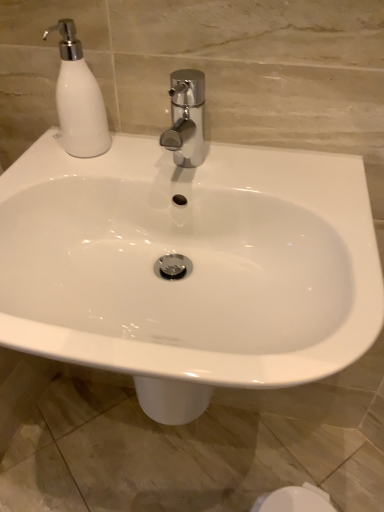
Question: From the image's perspective, is white glossy sink at center positioned above or below white glossy soap dispenser at upper left?

Choices:
 (A) below
 (B) above

Answer: (A)

Question: From a real-world perspective, is white glossy sink at center positioned above or below white glossy soap dispenser at upper left?

Choices:
 (A) below
 (B) above

Answer: (A)

Question: Looking at their shapes, would you say white glossy sink at center is wider or thinner than white glossy soap dispenser at upper left?

Choices:
 (A) thin
 (B) wide

Answer: (B)

Question: Considering the positions of white glossy soap dispenser at upper left and white glossy sink at center in the image, is white glossy soap dispenser at upper left wider or thinner than white glossy sink at center?

Choices:
 (A) wide
 (B) thin

Answer: (B)

Question: From the image's perspective, is white glossy soap dispenser at upper left positioned above or below white glossy sink at center?

Choices:
 (A) below
 (B) above

Answer: (B)

Question: From a real-world perspective, is white glossy soap dispenser at upper left above or below white glossy sink at center?

Choices:
 (A) above
 (B) below

Answer: (A)

Question: Is white glossy soap dispenser at upper left taller or shorter than white glossy sink at center?

Choices:
 (A) short
 (B) tall

Answer: (A)